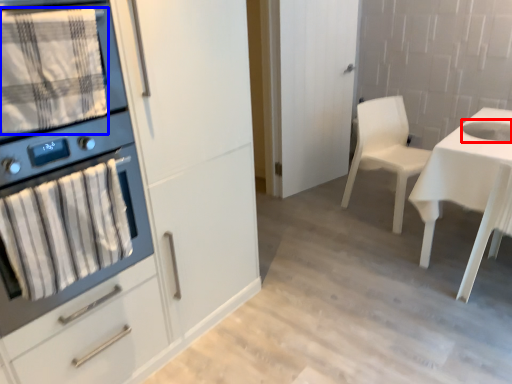
Question: Which object appears farthest to the camera in this image, sink (highlighted by a red box) or blanket (highlighted by a blue box)?

Choices:
 (A) sink
 (B) blanket

Answer: (A)